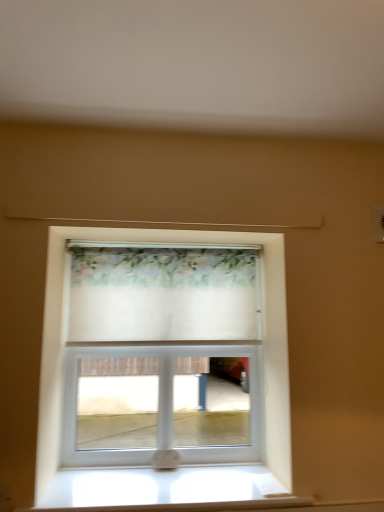
This screenshot has height=512, width=384. Find the location of `white wood window sill at lower center`. white wood window sill at lower center is located at coordinates (166, 489).

At what (x,y) coordinates should I click in order to perform the action: click on white fabric at center. Please return your answer as a coordinate pair (x, y). Looking at the image, I should click on (166, 242).

Does point (269, 426) come in front of point (140, 502)?

No, (269, 426) is behind (140, 502).

From a real-world perspective, is white fabric at center physically located above or below white wood window sill at lower center?

In terms of real-world spatial position, white fabric at center is above white wood window sill at lower center.

Is white fabric at center behind white wood window sill at lower center?

That is True.

Does white wood window sill at lower center turn towards white fabric at center?

No.

Which object is thinner, white wood window sill at lower center or white fabric at center?

With smaller width is white fabric at center.

Which is more to the right, white wood window sill at lower center or white fabric at center?

From the viewer's perspective, white wood window sill at lower center appears more on the right side.

Which is in front, white wood window sill at lower center or white fabric at center?

white wood window sill at lower center is in front.

Consider the image. In terms of height, does floral sheer curtain at center look taller or shorter compared to white fabric at center?

floral sheer curtain at center is shorter than white fabric at center.

Which is closer, [175,259] or [149,232]?

Point [175,259] is positioned farther from the camera compared to point [149,232].

Is floral sheer curtain at center bigger or smaller than white fabric at center?

In the image, floral sheer curtain at center appears to be smaller than white fabric at center.

From the image's perspective, who appears lower, floral sheer curtain at center or white fabric at center?

white fabric at center, from the image's perspective.

Considering the sizes of objects white wood window sill at lower center and floral sheer curtain at center in the image provided, who is thinner, white wood window sill at lower center or floral sheer curtain at center?

floral sheer curtain at center.

Based on the photo, which object is closer to the camera taking this photo, white wood window sill at lower center or floral sheer curtain at center?

white wood window sill at lower center is closer to the camera.

Considering the sizes of white wood window sill at lower center and floral sheer curtain at center in the image, is white wood window sill at lower center taller or shorter than floral sheer curtain at center?

white wood window sill at lower center is shorter than floral sheer curtain at center.

From the image's perspective, is floral sheer curtain at center positioned above or below white wood window sill at lower center?

Clearly, from the image's perspective, floral sheer curtain at center is above white wood window sill at lower center.

Is floral sheer curtain at center in contact with white wood window sill at lower center?

floral sheer curtain at center and white wood window sill at lower center are not in contact.

Is floral sheer curtain at center facing away from white wood window sill at lower center?

No, white wood window sill at lower center is not at the back of floral sheer curtain at center.

Based on the photo, from the image's perspective, is white fabric at center on floral sheer curtain at center?

Incorrect, from the image's perspective, white fabric at center is lower than floral sheer curtain at center.

From a real-world perspective, who is located higher, white fabric at center or floral sheer curtain at center?

In real-world perspective, floral sheer curtain at center is above.

Where is `curtain above the white fabric at center (from the image's perspective)`? The image size is (384, 512). curtain above the white fabric at center (from the image's perspective) is located at coordinates (162, 293).

Is white fabric at center wider or thinner than floral sheer curtain at center?

In the image, white fabric at center appears to be wider than floral sheer curtain at center.

The height and width of the screenshot is (512, 384). I want to click on window that is on the left side of white wood window sill at lower center, so click(166, 242).

You are a GUI agent. You are given a task and a screenshot of the screen. Output one action in this format:
    pyautogui.click(x=<x>, y=<y>)
    Task: Click on the window sill on the right of white fabric at center
    This screenshot has height=512, width=384.
    Given the screenshot: What is the action you would take?
    pyautogui.click(x=166, y=489)

In the scene shown: Estimate the real-world distances between objects in this image. Which object is further from floral sheer curtain at center, white fabric at center or white wood window sill at lower center?

The object further to floral sheer curtain at center is white wood window sill at lower center.

Based on their spatial positions, is white wood window sill at lower center or white fabric at center further from floral sheer curtain at center?

The object further to floral sheer curtain at center is white wood window sill at lower center.

Looking at the image, which one is located closer to white fabric at center, white wood window sill at lower center or floral sheer curtain at center?

floral sheer curtain at center.

Considering their positions, is floral sheer curtain at center positioned further to white fabric at center than white wood window sill at lower center?

white wood window sill at lower center lies further to white fabric at center than the other object.

Based on their spatial positions, is white fabric at center or floral sheer curtain at center closer to white wood window sill at lower center?

white fabric at center is positioned closer to the anchor white wood window sill at lower center.

When comparing their distances from white wood window sill at lower center, does floral sheer curtain at center or white fabric at center seem closer?

white fabric at center is positioned closer to the anchor white wood window sill at lower center.

Locate an element on the screen. window between floral sheer curtain at center and white wood window sill at lower center in the vertical direction is located at coordinates (166, 242).